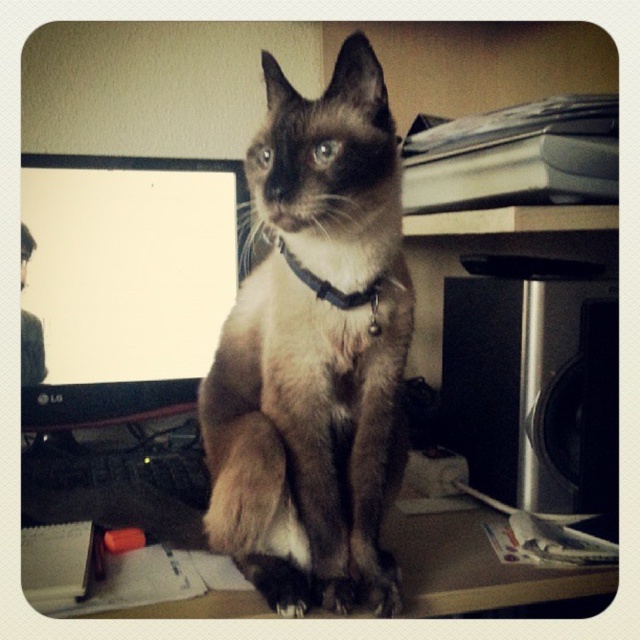
Question: Based on their relative distances, which object is nearer to the matte black monitor at left?

Choices:
 (A) brown wooden table at lower center
 (B) black leather collar at center
 (C) smokey brown fur at center

Answer: (A)

Question: Is smokey brown fur at center above matte black monitor at left?

Choices:
 (A) yes
 (B) no

Answer: (B)

Question: Is smokey brown fur at center smaller than brown wooden table at lower center?

Choices:
 (A) yes
 (B) no

Answer: (B)

Question: Where is matte black monitor at left located in relation to brown wooden table at lower center in the image?

Choices:
 (A) above
 (B) below

Answer: (A)

Question: Which point is farther from the camera taking this photo?

Choices:
 (A) (243, 192)
 (B) (292, 264)
 (C) (440, 600)

Answer: (A)

Question: Which of the following is the closest to the observer?

Choices:
 (A) (340, 136)
 (B) (470, 572)
 (C) (346, 300)
 (D) (32, 236)

Answer: (A)